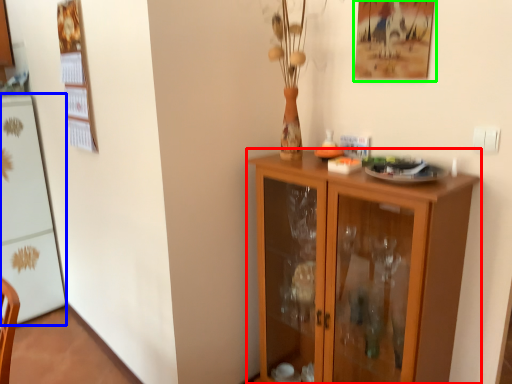
Question: Which is nearer to the cupboard (highlighted by a red box)? appliance (highlighted by a blue box) or picture frame (highlighted by a green box).

Choices:
 (A) appliance
 (B) picture frame

Answer: (B)